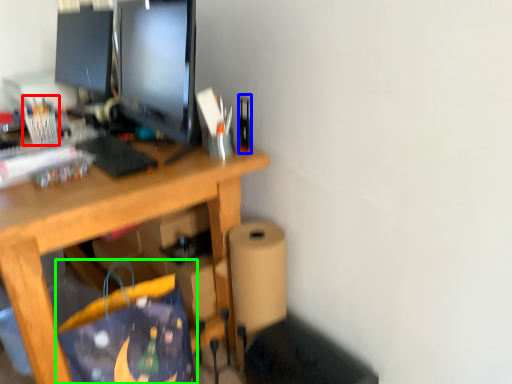
Question: Considering the real-world distances, which object is farthest from stationery (highlighted by a red box)? stationery (highlighted by a blue box) or shopping bag (highlighted by a green box)?

Choices:
 (A) stationery
 (B) shopping bag

Answer: (A)